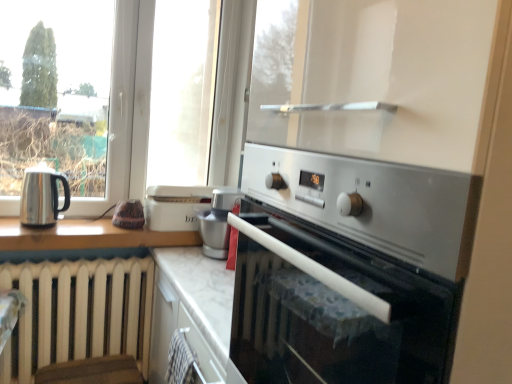
Identify the location of vacant region above shiny metallic kettle at left (from a real-world perspective). The image size is (512, 384). (40, 170).